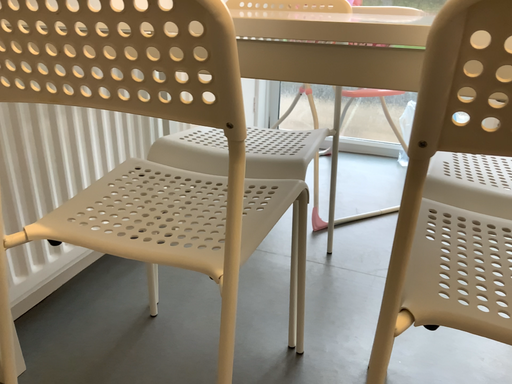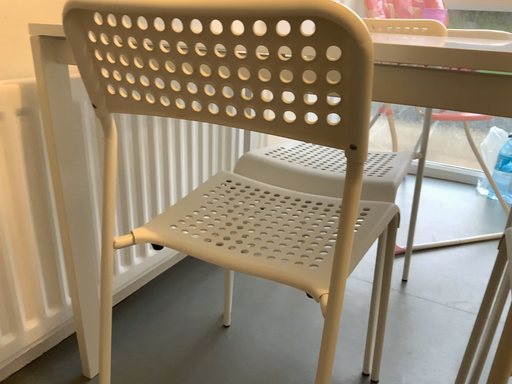
Question: How did the camera likely rotate when shooting the video?

Choices:
 (A) rotated right
 (B) rotated left

Answer: (B)